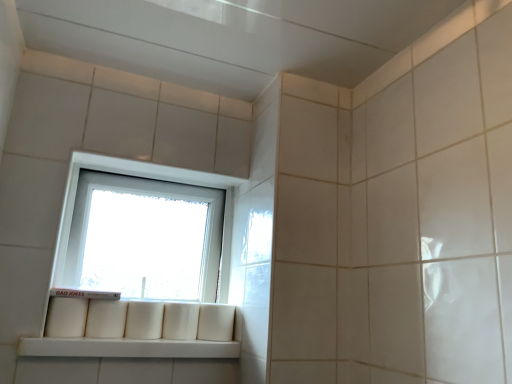
Question: Is white matte window sill at lower left surrounded by white plastic window at center?

Choices:
 (A) no
 (B) yes

Answer: (A)

Question: Is white plastic window at center not close to white matte window sill at lower left?

Choices:
 (A) yes
 (B) no

Answer: (B)

Question: From a real-world perspective, is white plastic window at center located higher than white matte window sill at lower left?

Choices:
 (A) no
 (B) yes

Answer: (B)

Question: Is white plastic window at center positioned with its back to white matte window sill at lower left?

Choices:
 (A) no
 (B) yes

Answer: (A)

Question: From the image's perspective, is white plastic window at center located beneath white matte window sill at lower left?

Choices:
 (A) yes
 (B) no

Answer: (B)

Question: From the image's perspective, would you say white plastic window at center is positioned over white matte window sill at lower left?

Choices:
 (A) yes
 (B) no

Answer: (A)

Question: Is white matte window sill at lower left beside white plastic window at center?

Choices:
 (A) no
 (B) yes

Answer: (A)

Question: Is white matte window sill at lower left oriented away from white plastic window at center?

Choices:
 (A) no
 (B) yes

Answer: (A)

Question: From the image's perspective, does white matte window sill at lower left appear lower than white plastic window at center?

Choices:
 (A) yes
 (B) no

Answer: (A)

Question: Considering the relative sizes of white matte window sill at lower left and white plastic window at center in the image provided, is white matte window sill at lower left wider than white plastic window at center?

Choices:
 (A) yes
 (B) no

Answer: (A)

Question: From the image's perspective, does white matte window sill at lower left appear higher than white plastic window at center?

Choices:
 (A) no
 (B) yes

Answer: (A)

Question: From a real-world perspective, is white matte window sill at lower left below white plastic window at center?

Choices:
 (A) yes
 (B) no

Answer: (A)

Question: From a real-world perspective, is white matte window sill at lower left positioned above or below white plastic window at center?

Choices:
 (A) above
 (B) below

Answer: (B)